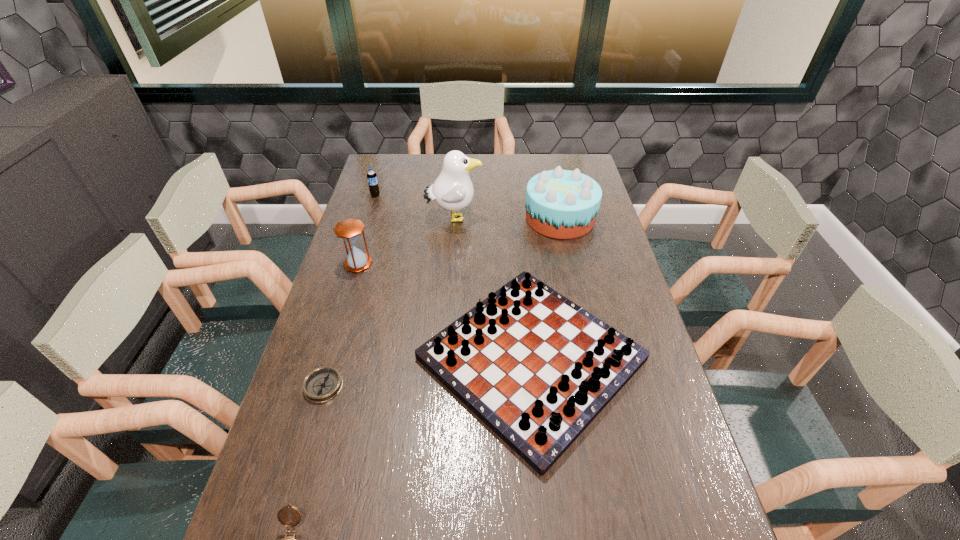
Where is `object identified as the sixth closest to the cake`? The height and width of the screenshot is (540, 960). object identified as the sixth closest to the cake is located at coordinates pos(283,515).

Locate an element on the screen. The height and width of the screenshot is (540, 960). free space that satisfies the following two spatial constraints: 1. on the beak of the chessboard; 2. on the right side of the gull is located at coordinates pos(444,359).

The width and height of the screenshot is (960, 540). Identify the location of vacant region that satisfies the following two spatial constraints: 1. on the front side of the hourglass; 2. on the right side of the shorter compass. (322, 386).